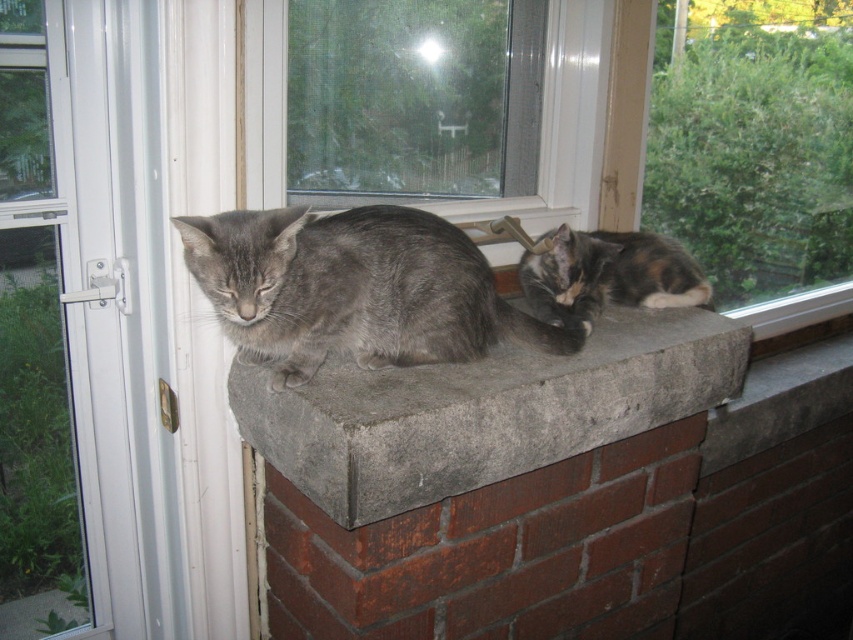
Based on the photo, can you confirm if matte gray cat at center is taller than transparent glass window at upper right?

No.

Is point (460, 429) more distant than point (695, 200)?

No, it is not.

The width and height of the screenshot is (853, 640). I want to click on matte gray cat at center, so click(483, 410).

I want to click on gray soft fur cat at center, so click(352, 289).

Is gray soft fur cat at center positioned behind calico fur cat at right?

No, it is in front of calico fur cat at right.

Locate an element on the screen. This screenshot has height=640, width=853. gray soft fur cat at center is located at coordinates (352, 289).

Where is `gray soft fur cat at center`? This screenshot has width=853, height=640. gray soft fur cat at center is located at coordinates (352, 289).

Does matte gray cat at center appear on the left side of gray soft fur cat at center?

No, matte gray cat at center is not to the left of gray soft fur cat at center.

Is matte gray cat at center taller than gray soft fur cat at center?

Correct, matte gray cat at center is much taller as gray soft fur cat at center.

This screenshot has height=640, width=853. I want to click on matte gray cat at center, so click(x=483, y=410).